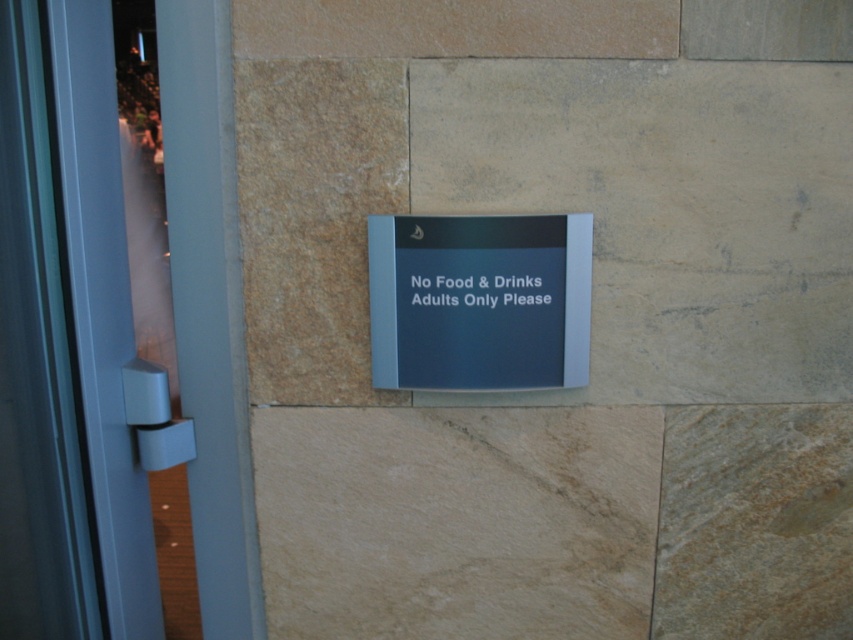
You are standing in front of the wall with the sign. Where is the transparent glass door at center located?

The transparent glass door at center is located at point (109,332).

You are standing in front of the wall with the sign. You need to exit through the transparent glass door at center. Which direction should you move relative to the black plastic sign at center to reach the door?

The transparent glass door at center is located below the black plastic sign at center, so you should move downward towards the transparent glass door at center to reach it.

You are standing in front of a wall with two signs. The blue plastic sign at center and the black plastic sign at center. Which one is taller?

The blue plastic sign at center is taller than the black plastic sign at center.